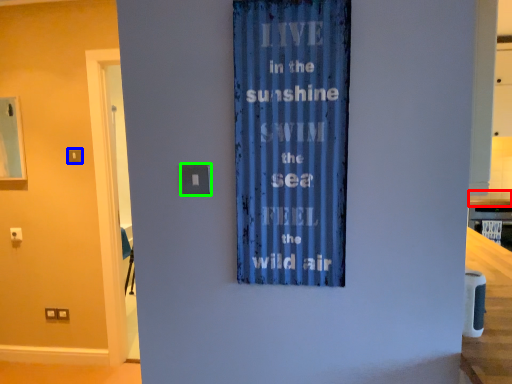
Question: Estimate the real-world distances between objects in this image. Which object is closer to counter top (highlighted by a red box), light switch (highlighted by a blue box) or light switch (highlighted by a green box)?

Choices:
 (A) light switch
 (B) light switch

Answer: (B)